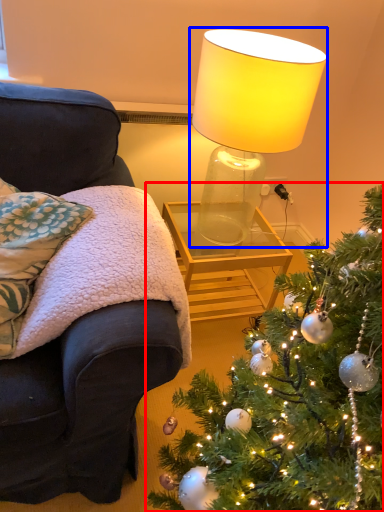
Question: Among these objects, which one is farthest to the camera, christmas tree (highlighted by a red box) or lamp (highlighted by a blue box)?

Choices:
 (A) christmas tree
 (B) lamp

Answer: (B)